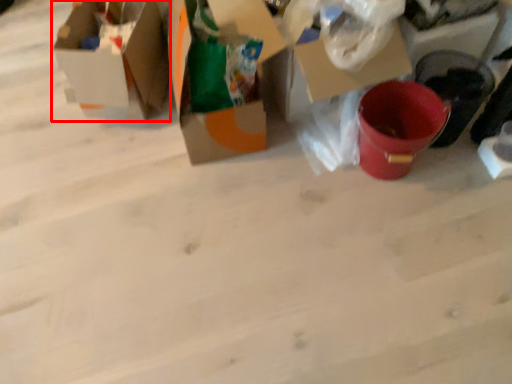
Question: From the image's perspective, what is the correct spatial positioning of box (annotated by the red box) in reference to box?

Choices:
 (A) below
 (B) above

Answer: (B)